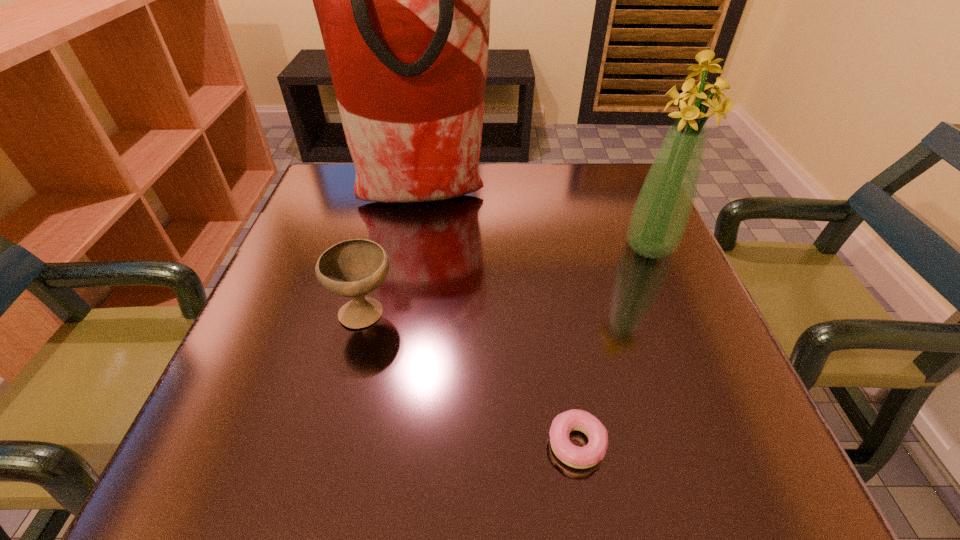
The width and height of the screenshot is (960, 540). I want to click on vacant area at the left edge of the desktop, so click(x=350, y=228).

Locate an element on the screen. free space at the right edge of the desktop is located at coordinates (620, 298).

This screenshot has height=540, width=960. Identify the location of vacant space at the far left corner of the desktop. (356, 209).

At what (x,y) coordinates should I click in order to perform the action: click on vacant region at the far right corner. Please return your answer as a coordinate pair (x, y). The image size is (960, 540). Looking at the image, I should click on (607, 186).

In the image, there is a desktop. At what (x,y) coordinates should I click in order to perform the action: click on blank space at the near right corner. Please return your answer as a coordinate pair (x, y). Looking at the image, I should click on (686, 439).

Locate an element on the screen. unoccupied position between the third farthest object and the nearest object is located at coordinates (470, 378).

Image resolution: width=960 pixels, height=540 pixels. Identify the location of blank region between the grocery bag and the bouquet. (537, 222).

I want to click on empty space that is in between the third tallest object and the tallest object, so (395, 255).

You are a GUI agent. You are given a task and a screenshot of the screen. Output one action in this format:
    pyautogui.click(x=<x>, y=<y>)
    Task: Click on the free space between the chalice and the farthest object
    This screenshot has height=540, width=960.
    Given the screenshot: What is the action you would take?
    pyautogui.click(x=395, y=255)

What are the coordinates of `vacant area that lies between the shortest object and the grocery bag` in the screenshot? It's located at (500, 321).